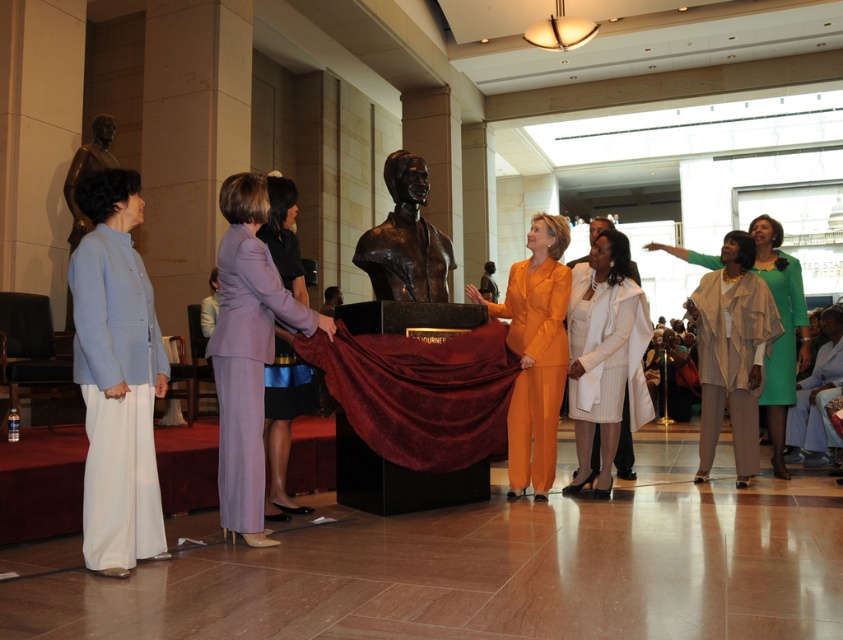
In the scene shown: Is lavender fabric suit at center to the right of orange matte suit at center from the viewer's perspective?

No, lavender fabric suit at center is not to the right of orange matte suit at center.

Consider the image. Does lavender fabric suit at center have a greater height compared to orange matte suit at center?

No.

The height and width of the screenshot is (640, 843). Find the location of `lavender fabric suit at center`. lavender fabric suit at center is located at coordinates (247, 349).

This screenshot has height=640, width=843. In order to click on beige textured coat at right in this screenshot , I will do `click(731, 353)`.

Can you confirm if beige textured coat at right is shorter than bronze bust at center?

In fact, beige textured coat at right may be taller than bronze bust at center.

Is point (739, 468) less distant than point (390, 196)?

No, it is behind (390, 196).

Locate an element on the screen. beige textured coat at right is located at coordinates (731, 353).

Does light blue fabric coat at left have a lesser width compared to orange matte suit at center?

Yes, light blue fabric coat at left is thinner than orange matte suit at center.

Identify the location of light blue fabric coat at left. This screenshot has width=843, height=640. (116, 378).